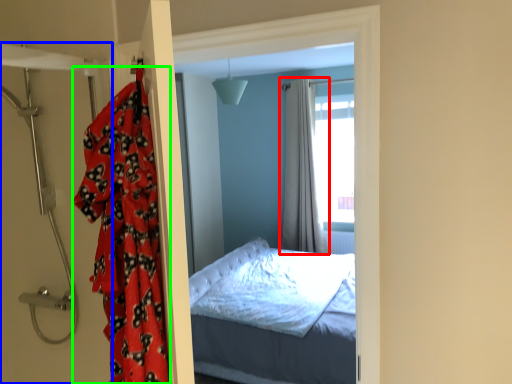
Question: Which object is the farthest from curtain (highlighted by a red box)? Choose among these: door (highlighted by a blue box) or blanket (highlighted by a green box).

Choices:
 (A) door
 (B) blanket

Answer: (B)